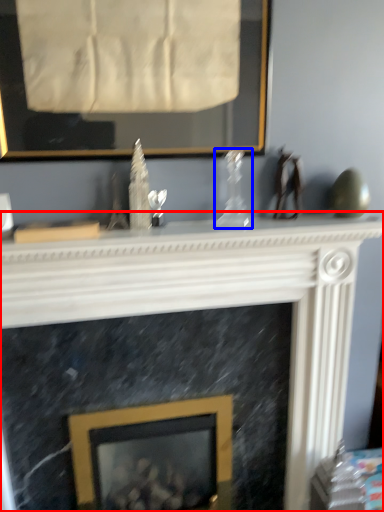
Question: Which point is closer to the camera, fireplace (highlighted by a red box) or glass vase (highlighted by a blue box)?

Choices:
 (A) fireplace
 (B) glass vase

Answer: (A)